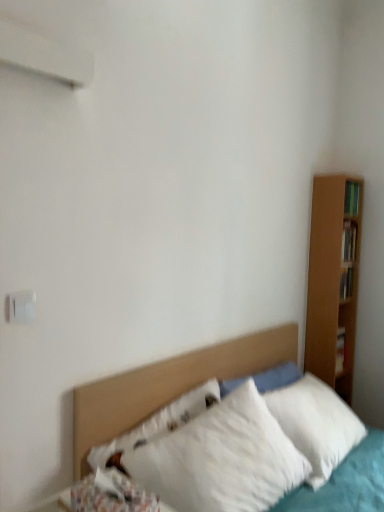
Measure the distance between fluffy white pillow at lower left and camera.

They are 3.94 feet apart.

The height and width of the screenshot is (512, 384). In order to click on white fluffy pillows at center in this screenshot , I will do `click(168, 385)`.

Identify the location of fluffy white pillow at lower left. The width and height of the screenshot is (384, 512). (111, 494).

Between fluffy white pillow at lower left and white plastic electric outlet at upper left, which one has larger width?

fluffy white pillow at lower left is wider.

Where is `pillow beneath the white plastic electric outlet at upper left (from a real-world perspective)`? The width and height of the screenshot is (384, 512). pillow beneath the white plastic electric outlet at upper left (from a real-world perspective) is located at coordinates (111, 494).

Who is bigger, fluffy white pillow at lower left or white plastic electric outlet at upper left?

With larger size is fluffy white pillow at lower left.

Who is smaller, fluffy white pillow at lower left or white fluffy pillows at center?

With smaller size is fluffy white pillow at lower left.

Which is correct: fluffy white pillow at lower left is inside white fluffy pillows at center, or outside of it?

fluffy white pillow at lower left exists outside the volume of white fluffy pillows at center.

Considering the relative positions of fluffy white pillow at lower left and white fluffy pillows at center in the image provided, is fluffy white pillow at lower left to the right of white fluffy pillows at center from the viewer's perspective?

In fact, fluffy white pillow at lower left is to the left of white fluffy pillows at center.

How far apart are fluffy white pillow at lower left and white fluffy pillows at center?

They are 16.04 inches apart.

From the image's perspective, relative to white plastic electric outlet at upper left, is white fluffy pillows at center above or below?

white fluffy pillows at center is situated lower than white plastic electric outlet at upper left in the image.

Could you tell me if white fluffy pillows at center is turned towards white plastic electric outlet at upper left?

No, white fluffy pillows at center is not aimed at white plastic electric outlet at upper left.

Can you tell me how much white fluffy pillows at center and white plastic electric outlet at upper left differ in facing direction?

The angle between the facing direction of white fluffy pillows at center and the facing direction of white plastic electric outlet at upper left is 0.4 degrees.

Is white fluffy pillows at center at the left side of white plastic electric outlet at upper left?

No.

Is white plastic electric outlet at upper left at the left side of white fluffy pillows at center?

Yes, white plastic electric outlet at upper left is to the left of white fluffy pillows at center.

Can you confirm if white plastic electric outlet at upper left is wider than white fluffy pillows at center?

Incorrect, the width of white plastic electric outlet at upper left does not surpass that of white fluffy pillows at center.

Based on the photo, which is correct: white plastic electric outlet at upper left is inside white fluffy pillows at center, or outside of it?

white plastic electric outlet at upper left is spatially situated outside white fluffy pillows at center.

Is the depth of white plastic electric outlet at upper left less than that of white fluffy pillows at center?

No, it is behind white fluffy pillows at center.

Is fluffy white pillow at lower left at the back of white fluffy pillows at center?

No, white fluffy pillows at center is not facing away from fluffy white pillow at lower left.

Which is in front, white fluffy pillows at center or fluffy white pillow at lower left?

fluffy white pillow at lower left is in front.

Based on their sizes in the image, would you say white fluffy pillows at center is bigger or smaller than fluffy white pillow at lower left?

Considering their sizes, white fluffy pillows at center takes up more space than fluffy white pillow at lower left.

Considering the positions of point (251, 369) and point (73, 498), is point (251, 369) closer or farther from the camera than point (73, 498)?

Point (251, 369) is positioned farther from the camera compared to point (73, 498).

Which object is further away from the camera, white plastic electric outlet at upper left or fluffy white pillow at lower left?

Positioned behind is white plastic electric outlet at upper left.

From the image's perspective, is white plastic electric outlet at upper left located beneath fluffy white pillow at lower left?

No, from the image's perspective, white plastic electric outlet at upper left is not below fluffy white pillow at lower left.

Is white plastic electric outlet at upper left at the right side of fluffy white pillow at lower left?

Incorrect, white plastic electric outlet at upper left is not on the right side of fluffy white pillow at lower left.

From a real-world perspective, who is located lower, white plastic electric outlet at upper left or fluffy white pillow at lower left?

From a 3D spatial view, fluffy white pillow at lower left is below.

At what (x,y) coordinates should I click in order to perform the action: click on electric outlet on the left of fluffy white pillow at lower left. Please return your answer as a coordinate pair (x, y). Looking at the image, I should click on (20, 307).

Where is `bed behind the fluffy white pillow at lower left`? The width and height of the screenshot is (384, 512). bed behind the fluffy white pillow at lower left is located at coordinates (168, 385).

When comparing their distances from white fluffy pillows at center, does fluffy white pillow at lower left or white plastic electric outlet at upper left seem closer?

Based on the image, fluffy white pillow at lower left appears to be nearer to white fluffy pillows at center.

Looking at the image, which one is located closer to fluffy white pillow at lower left, white fluffy pillows at center or white plastic electric outlet at upper left?

The object closer to fluffy white pillow at lower left is white fluffy pillows at center.

Which object lies further to the anchor point white plastic electric outlet at upper left, white fluffy pillows at center or fluffy white pillow at lower left?

white fluffy pillows at center is positioned further to the anchor white plastic electric outlet at upper left.

Which object lies further to the anchor point fluffy white pillow at lower left, white plastic electric outlet at upper left or white fluffy pillows at center?

white plastic electric outlet at upper left lies further to fluffy white pillow at lower left than the other object.

Based on the photo, looking at the image, which one is located further to white plastic electric outlet at upper left, fluffy white pillow at lower left or white fluffy pillows at center?

white fluffy pillows at center is positioned further to the anchor white plastic electric outlet at upper left.

Considering their positions, is white plastic electric outlet at upper left positioned further to white fluffy pillows at center than fluffy white pillow at lower left?

Based on the image, white plastic electric outlet at upper left appears to be further to white fluffy pillows at center.

The height and width of the screenshot is (512, 384). Identify the location of pillow situated between white plastic electric outlet at upper left and white fluffy pillows at center from left to right. (111, 494).